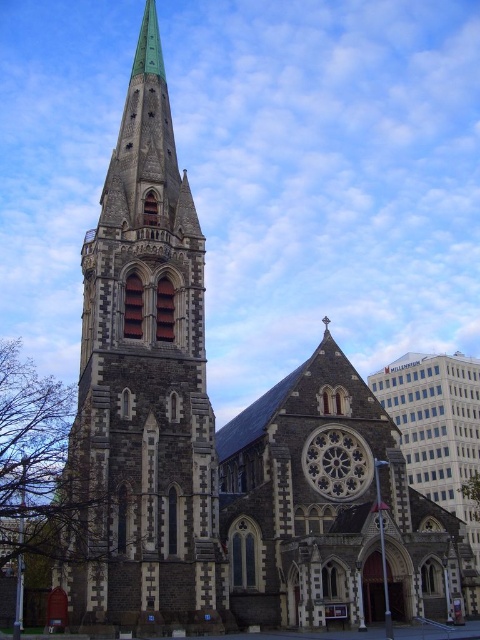
You are standing in front of the Gothic church and want to locate the stone steeple at left and the dark gray stone clock at center. From your perspective, which one is positioned to the left side?

The stone steeple at left is positioned to the left of the dark gray stone clock at center, so the stone steeple at left is on the left side.

You are standing at the entrance of the grand Gothic church and want to take a photo of the stone steeple at left. If your camera can focus on objects up to 150 feet away, will you be able to capture the steeple clearly?

The stone steeple at left is 162.69 feet away from the camera, which exceeds the camera focus limit of 150 feet. Therefore, the steeple will not be in focus and the photo will be blurry.

Based on the provided scene description, where is the stone steeple at left located in the image?

The stone steeple at left is located at point coordinates of (144, 387).